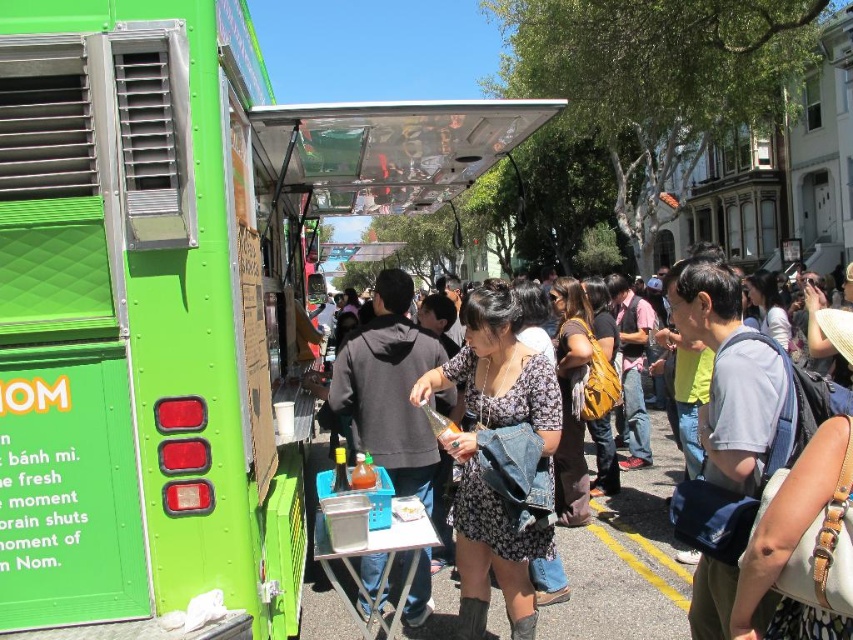
You are a food truck operator standing at the green matte food truck at center. You need to reach a customer who is 3.61 meters away. Is this distance within a typical conversational distance for effective communication?

The customer is 3.61 meters away from the green matte food truck at center. Conversational distance for effective communication is typically between 1 to 2 meters. Therefore, the distance is too far for clear conversation without raising your voice.